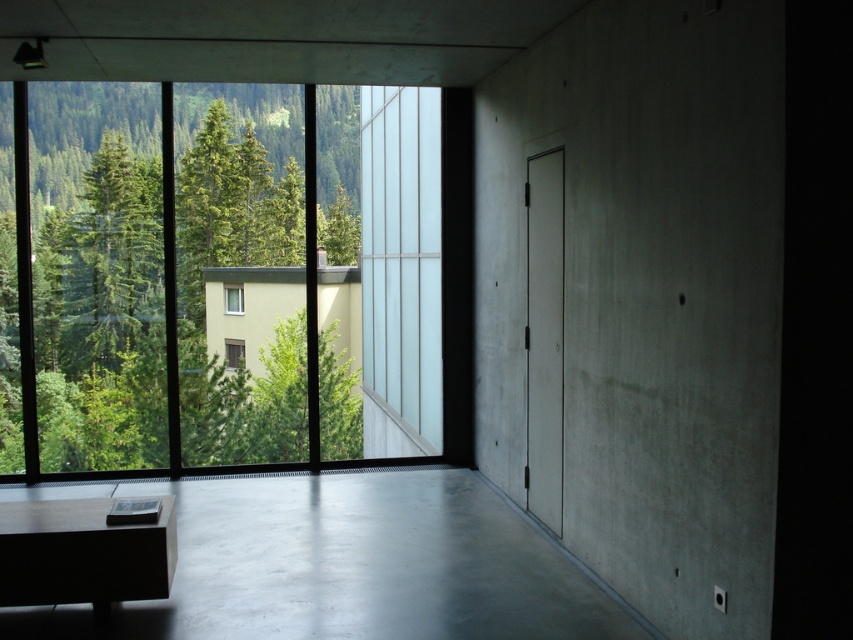
You are planning to place a large potted plant on the smooth concrete table at lower left. Considering the size of the table and the window, will the plant obstruct the view through the clear glass window at center?

The smooth concrete table at lower left has a larger size compared to clear glass window at center. Since the table is larger, placing a large potted plant on it might block part of the window view.

You are standing in the room and want to compare the sizes of the green leafy tree at left and the smooth concrete table at lower left. Which one appears wider from your current viewpoint?

The green leafy tree at left appears wider than the smooth concrete table at lower left because its width is larger than the table.